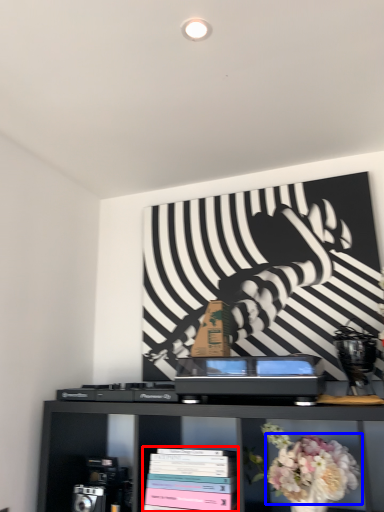
Question: Which object appears farthest to the camera in this image, book (highlighted by a red box) or flower (highlighted by a blue box)?

Choices:
 (A) book
 (B) flower

Answer: (A)